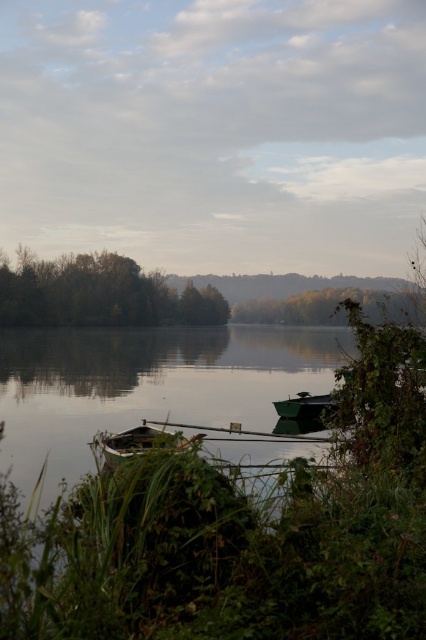
Question: Which of these objects is positioned farthest from the wooden boat at center?

Choices:
 (A) green leafy trees at left
 (B) green wooden boat at right

Answer: (A)

Question: Does green leafy tree at center appear on the left side of wooden boat at center?

Choices:
 (A) yes
 (B) no

Answer: (B)

Question: Is the position of green leafy tree at center more distant than that of green wooden boat at right?

Choices:
 (A) yes
 (B) no

Answer: (A)

Question: Which of the following is the farthest from the observer?

Choices:
 (A) green leafy tree at center
 (B) wooden boat at center
 (C) green leafy trees at left

Answer: (C)

Question: Which object is farther from the camera taking this photo?

Choices:
 (A) green wooden boat at right
 (B) wooden boat at center
 (C) green leafy trees at left
 (D) green leafy tree at center

Answer: (C)

Question: Does green leafy trees at left appear over green wooden boat at right?

Choices:
 (A) no
 (B) yes

Answer: (B)